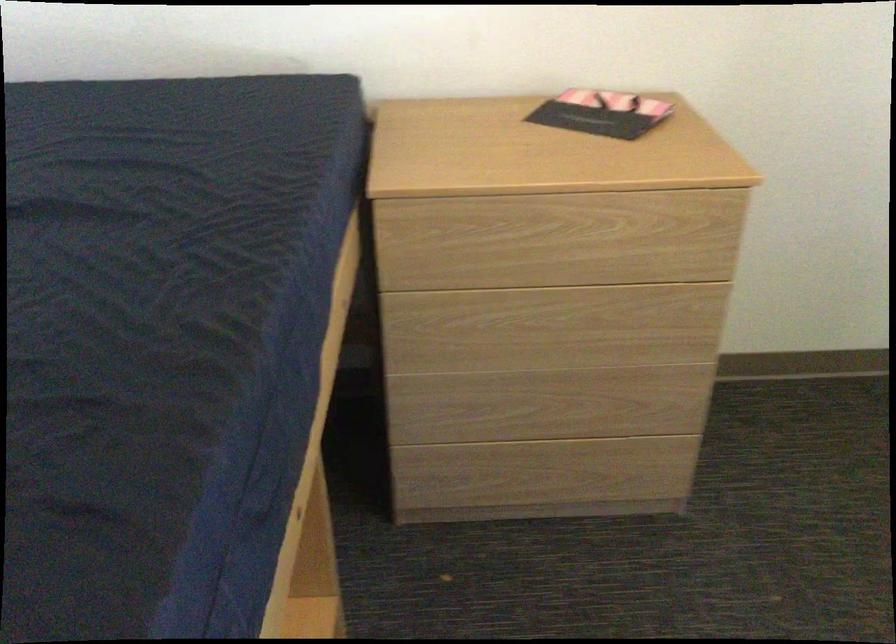
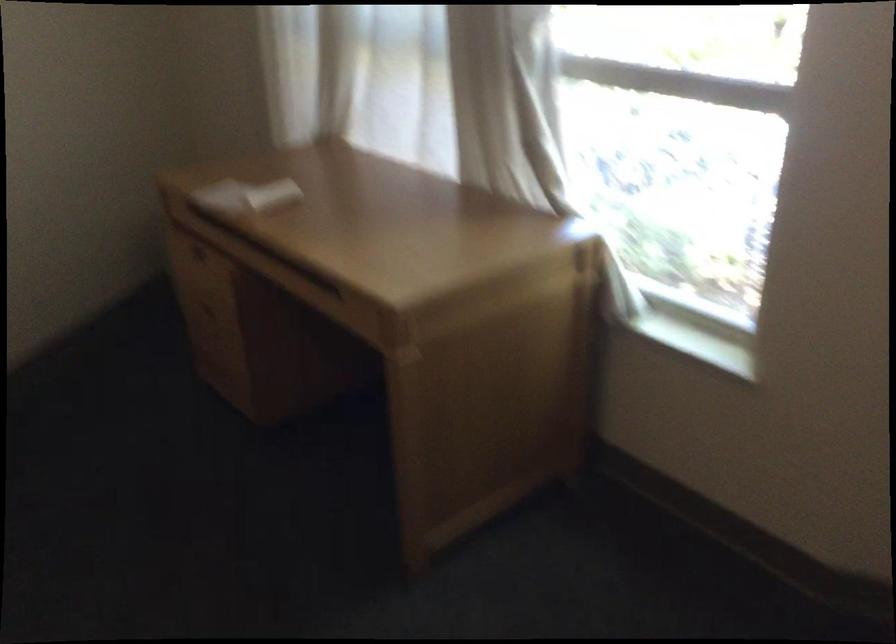
Question: Based on the continuous images, in which direction is the camera rotating? Reply with the corresponding letter.

Choices:
 (A) Left
 (B) Right
 (C) Up
 (D) Down

Answer: (B)